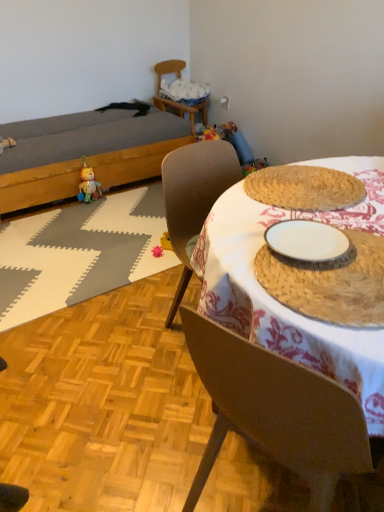
Locate an element on the screen. The image size is (384, 512). vacant area that is in front of pink rubber toy at center, positioned as the 1th toy in right-to-left order is located at coordinates (153, 267).